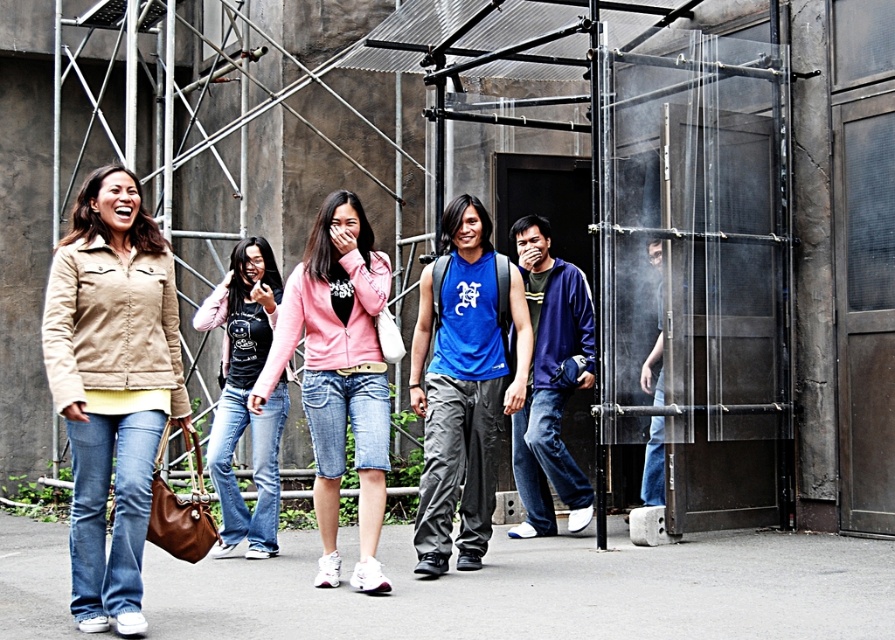
You are a photographer trying to capture a candid shot of the group. You notice the pink matte jacket at center and the black cotton shirt at center. Which one is positioned higher in the frame?

The pink matte jacket at center is above the black cotton shirt at center, so it is positioned higher in the frame.

You are a fashion designer observing the group of six individuals in the urban setting. You notice the blue cotton tank top at center and the pink matte jacket at center. Which clothing item is shorter in height?

The blue cotton tank top at center is not as tall as the pink matte jacket at center, so the blue cotton tank top at center is shorter in height.

You are a photographer trying to capture a group photo of the six individuals in the scene. The pink matte jacket at center and the black cotton shirt at center are both in the middle of the frame. If you want to ensure both are fully visible in the photo, which clothing item might require you to adjust the camera angle to accommodate its width?

The pink matte jacket at center might be wider than the black cotton shirt at center, so adjusting the camera angle to account for its width would ensure both are fully visible.